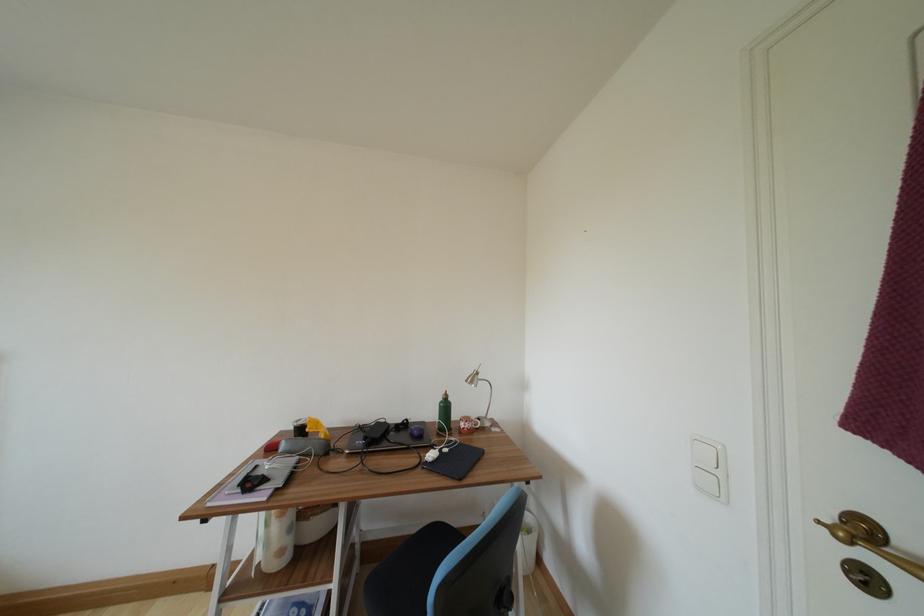
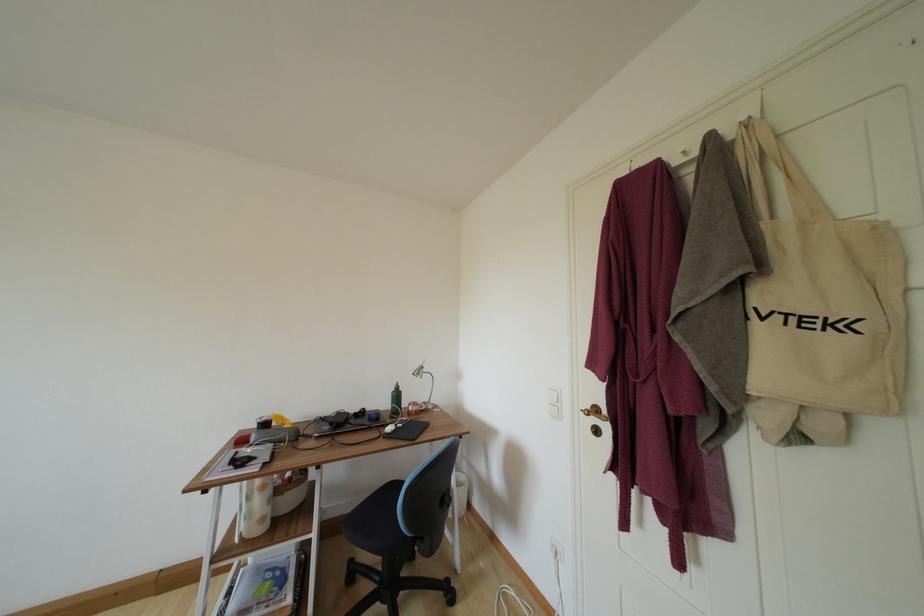
Find the pixel in the second image that matches pixel 445 407 in the first image.

(398, 395)